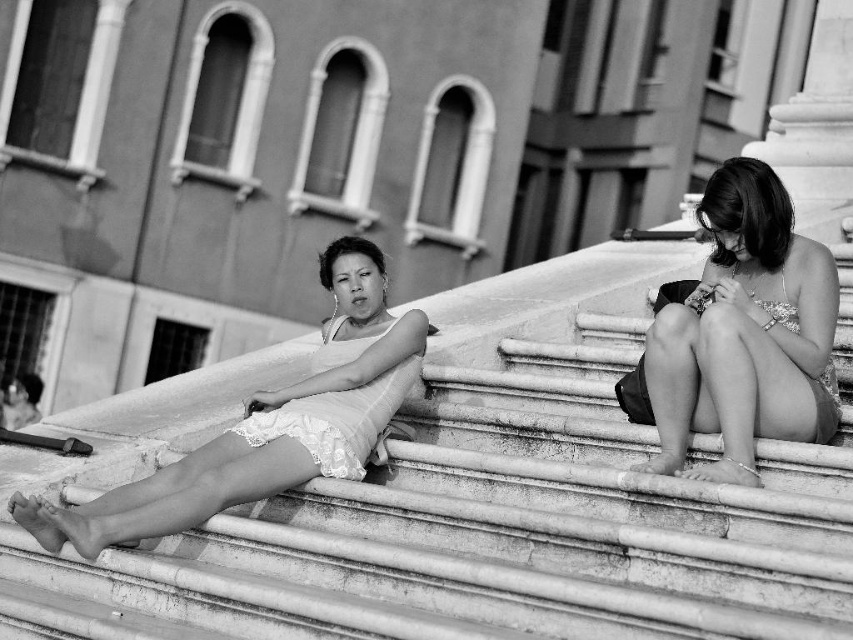
Based on the scene described, where is the smooth stone stairs at center located in relation to the lace fabric dress at center?

The smooth stone stairs at center are to the right of the lace fabric dress at center.